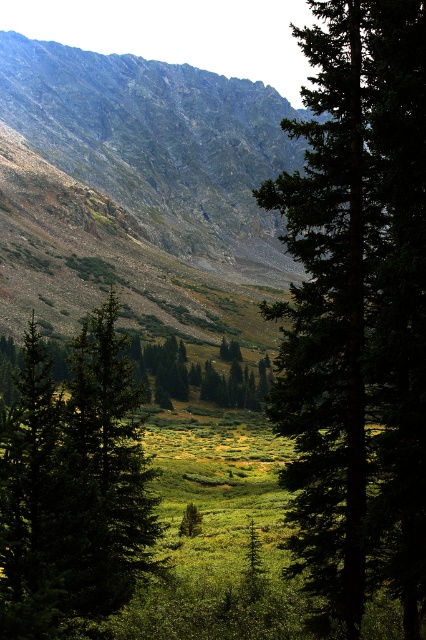
You are a hiker planning to take a photo of the rugged stone mountain at upper left from the valley below. Based on its position, which direction should you face to ensure the mountain is centered in your view?

The rugged stone mountain at upper left is located at point coordinates, so you should face the upper left direction to center it in your view.

You are a hiker planning to take a photo of the valley from the mountain view. You notice two trees in the center of your viewfinder labeled as green matte tree at center and green textured tree at center. Which tree should you focus on if you want to capture the one that appears higher in the frame?

The green matte tree at center is above the green textured tree at center, so you should focus on the green matte tree at center to capture the one that appears higher in the frame.